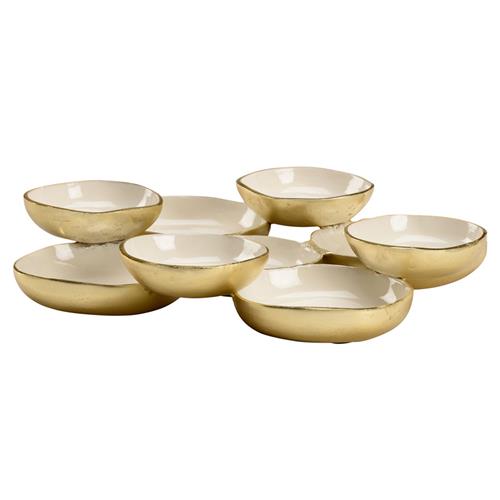
Locate an element on the screen. Image resolution: width=500 pixels, height=500 pixels. right side bowls is located at coordinates (389, 231), (340, 238), (337, 309).